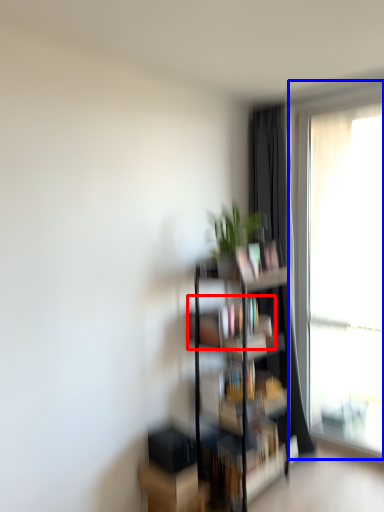
Question: Which of the following is the farthest to the observer, book (highlighted by a red box) or window (highlighted by a blue box)?

Choices:
 (A) book
 (B) window

Answer: (B)